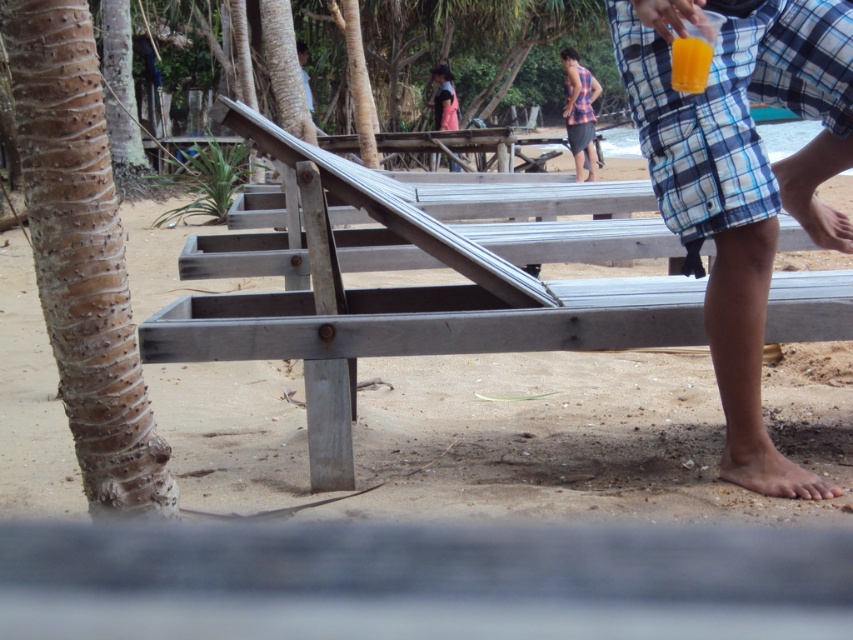
Question: Estimate the real-world distances between objects in this image. Which object is closer to the plaid fabric shirt at upper right?

Choices:
 (A) smooth wooden bench at center
 (B) blue plaid shorts at lower right
 (C) translucent plastic cup at upper right

Answer: (A)

Question: Does blue plaid shorts at lower right have a smaller size compared to brown rough bark palm tree at left?

Choices:
 (A) no
 (B) yes

Answer: (A)

Question: In this image, where is brown rough bark palm tree at left located relative to plaid fabric shirt at upper right?

Choices:
 (A) above
 (B) below

Answer: (B)

Question: Can you confirm if blue plaid shorts at lower right is smaller than brown rough bark palm tree at left?

Choices:
 (A) yes
 (B) no

Answer: (B)

Question: Among these objects, which one is farthest from the camera?

Choices:
 (A) blue plaid shorts at lower right
 (B) plaid fabric shirt at upper right
 (C) translucent plastic cup at upper right

Answer: (B)

Question: Which of the following is the closest to the observer?

Choices:
 (A) brown rough bark palm tree at left
 (B) plaid fabric shirt at upper right
 (C) smooth wooden bench at center
 (D) translucent plastic cup at upper right

Answer: (A)